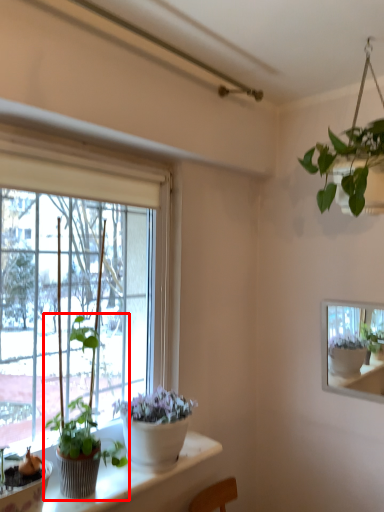
Question: From the image, what is the correct spatial relationship of houseplant (annotated by the red box) in relation to window?

Choices:
 (A) right
 (B) left

Answer: (B)